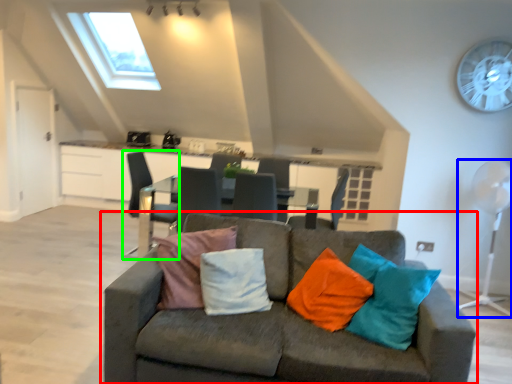
Question: Which is farther away from studio couch (highlighted by a red box)? mechanical fan (highlighted by a blue box) or chair (highlighted by a green box)?

Choices:
 (A) mechanical fan
 (B) chair

Answer: (A)